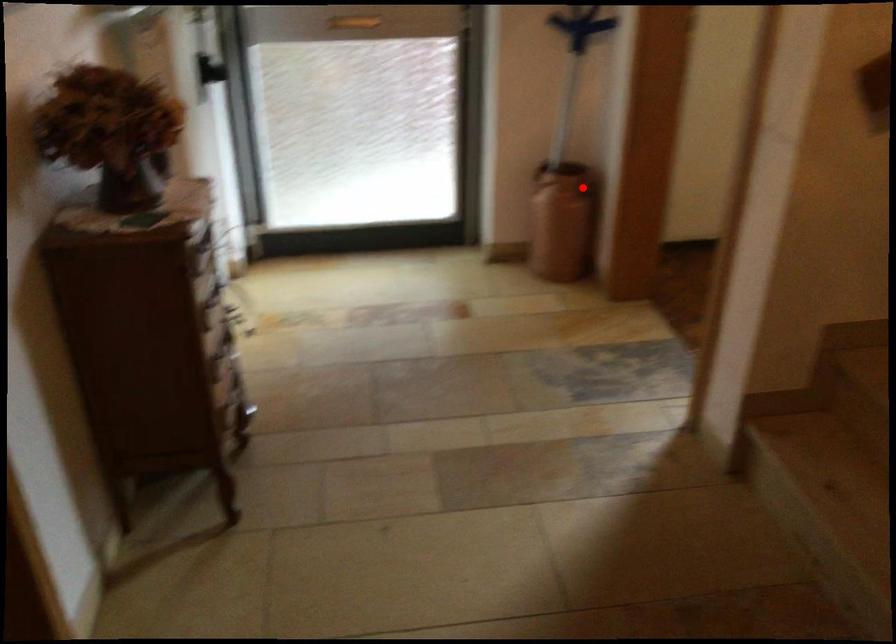
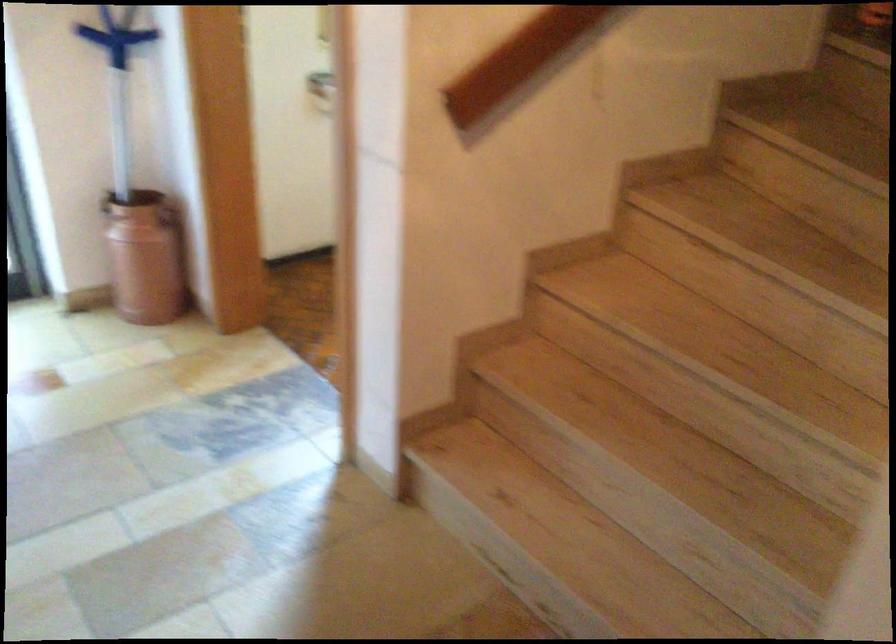
Question: I am providing you with two images of the same scene from different viewpoints. Given a red point in image1, look at the same physical point in image2. Is it:

Choices:
 (A) Closer to the viewpoint
 (B) Farther from the viewpoint

Answer: (A)